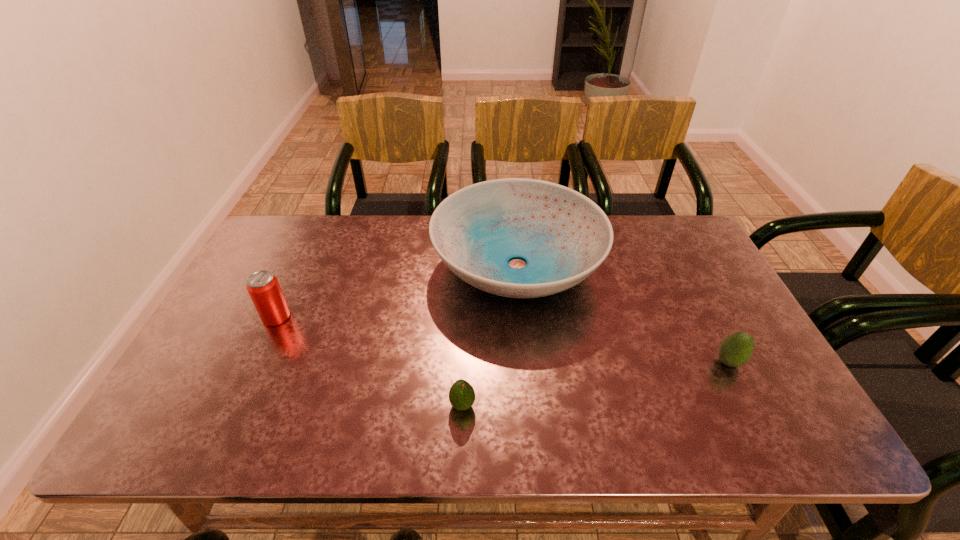
Where is `object that is the third closest to the shorter avocado`? object that is the third closest to the shorter avocado is located at coordinates (735, 350).

Find the location of `object that stands as the second closest to the can`. object that stands as the second closest to the can is located at coordinates pos(461,395).

Where is `vacant area that satisfies the following two spatial constraints: 1. on the back side of the dish; 2. on the left side of the left avocado`? vacant area that satisfies the following two spatial constraints: 1. on the back side of the dish; 2. on the left side of the left avocado is located at coordinates (468, 264).

Locate an element on the screen. vacant space that satisfies the following two spatial constraints: 1. on the back side of the dish; 2. on the right side of the can is located at coordinates (300, 264).

Locate an element on the screen. free space that satisfies the following two spatial constraints: 1. on the front side of the leftmost object; 2. on the left side of the taller avocado is located at coordinates (255, 362).